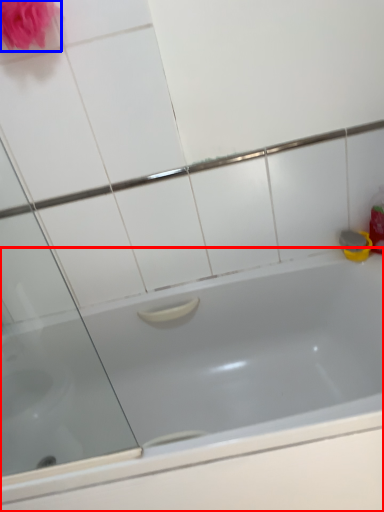
Question: Among these objects, which one is nearest to the camera, bathtub (highlighted by a red box) or rose (highlighted by a blue box)?

Choices:
 (A) bathtub
 (B) rose

Answer: (A)